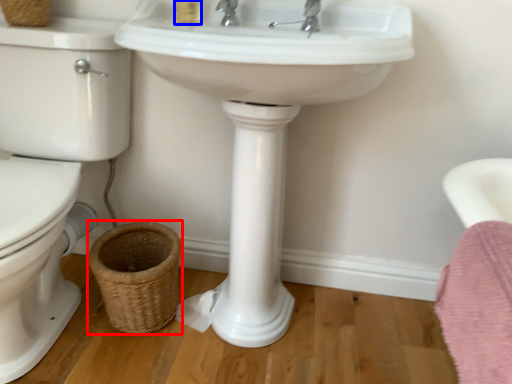
Question: Which object appears closest to the camera in this image, basket (highlighted by a red box) or toiletry (highlighted by a blue box)?

Choices:
 (A) basket
 (B) toiletry

Answer: (B)